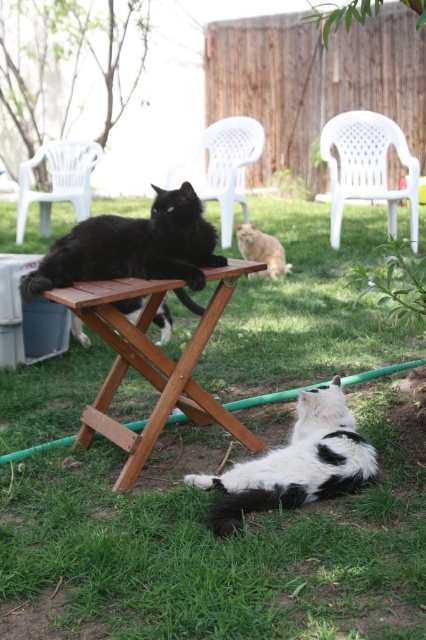
You are trying to decide whether to place a rectangular box on the wooden table at center. The box is as thick as the white plastic chair at upper right. Will the box fit on the table?

The wooden table at center is thinner than the white plastic chair at upper right. Since the box is as thick as the white plastic chair at upper right, it will not fit on the wooden table at center because the table is narrower in that dimension.

You are setting up a picnic and need to place a blanket between the white plastic chair at upper left and the fluffy orange cat at center. Considering their heights, which object should you place the blanket under first?

The white plastic chair at upper left is much taller than the fluffy orange cat at center, so you should place the blanket under the white plastic chair at upper left first to ensure it is positioned correctly.